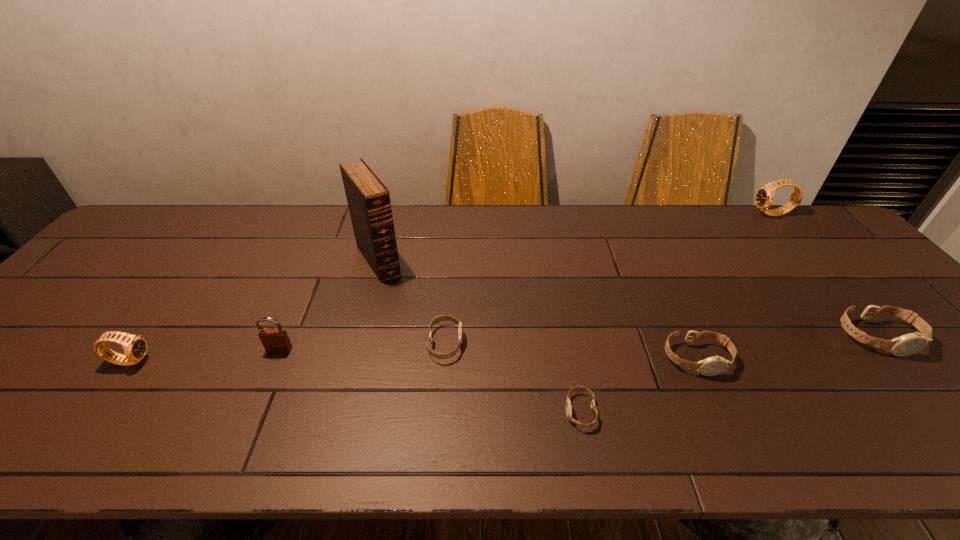
Locate an element on the screen. free space between the farthest watch and the second beige watch from right to left is located at coordinates (734, 286).

The image size is (960, 540). Identify the location of empty space that is in between the third tallest watch and the smaller black watch. (504, 349).

What are the coordinates of `free spot between the tallest object and the biggest beige watch` in the screenshot? It's located at (628, 299).

Where is `vacant area between the nearer black watch and the fourth shortest watch`? Image resolution: width=960 pixels, height=540 pixels. vacant area between the nearer black watch and the fourth shortest watch is located at coordinates (504, 349).

Where is `unoccupied position between the rightmost beige watch and the second biggest beige watch`? This screenshot has height=540, width=960. unoccupied position between the rightmost beige watch and the second biggest beige watch is located at coordinates (786, 348).

Where is `free point between the second beige watch from left to right and the sixth tallest object`? The image size is (960, 540). free point between the second beige watch from left to right and the sixth tallest object is located at coordinates (638, 384).

Where is `the seventh closest object to the rightmost beige watch`? the seventh closest object to the rightmost beige watch is located at coordinates (135, 347).

Where is `object that stands as the third closest to the fourth shortest object`? object that stands as the third closest to the fourth shortest object is located at coordinates (568, 403).

Select which watch appears as the second closest to the right black watch. Please provide its 2D coordinates. Your answer should be formatted as a tuple, i.e. [(x, y)], where the tuple contains the x and y coordinates of a point satisfying the conditions above.

[(711, 366)]

Locate which watch ranks fifth in proximity to the fifth watch from right to left. Please provide its 2D coordinates. Your answer should be formatted as a tuple, i.e. [(x, y)], where the tuple contains the x and y coordinates of a point satisfying the conditions above.

[(764, 197)]